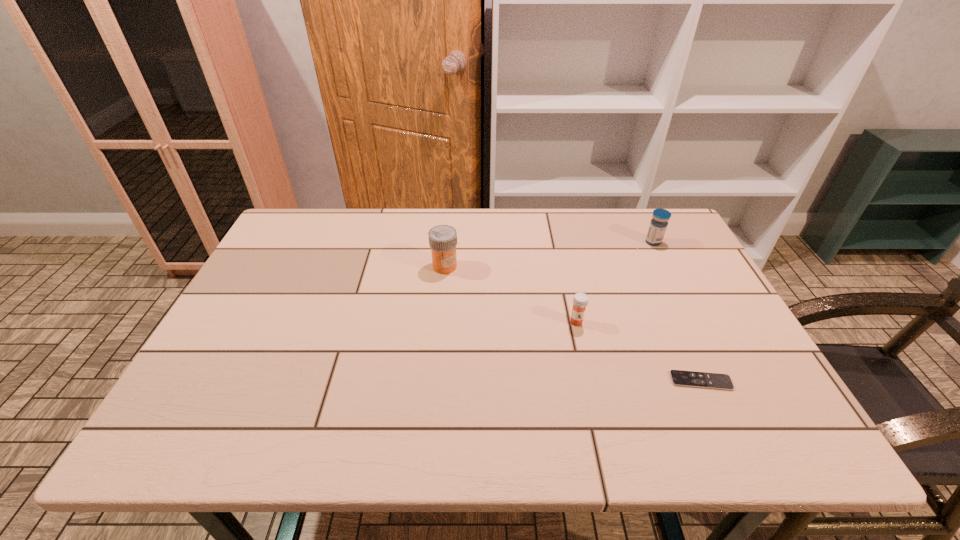
The height and width of the screenshot is (540, 960). In order to click on vacant region located on the label side of the third object from right to left in this screenshot , I will do `click(583, 353)`.

Identify the location of vacant region located 0.400m on the left of the nearest object. (492, 381).

Find the location of a particular element. Image resolution: width=960 pixels, height=540 pixels. object located in the far edge section of the desktop is located at coordinates (658, 225).

The height and width of the screenshot is (540, 960). Find the location of `medicine that is positioned at the right edge`. medicine that is positioned at the right edge is located at coordinates (658, 225).

At what (x,y) coordinates should I click in order to perform the action: click on remote control that is at the right edge. Please return your answer as a coordinate pair (x, y). Image resolution: width=960 pixels, height=540 pixels. Looking at the image, I should click on (679, 378).

Where is `object present at the far right corner`? The width and height of the screenshot is (960, 540). object present at the far right corner is located at coordinates (658, 225).

What are the coordinates of `blank space at the far edge of the desktop` in the screenshot? It's located at (468, 208).

This screenshot has height=540, width=960. In the image, there is a desktop. In order to click on free space at the near edge in this screenshot , I will do `click(321, 420)`.

You are a GUI agent. You are given a task and a screenshot of the screen. Output one action in this format:
    pyautogui.click(x=<x>, y=<y>)
    Task: Click on the vacant space at the left edge of the desktop
    
    Given the screenshot: What is the action you would take?
    pyautogui.click(x=262, y=370)

I want to click on vacant space at the right edge of the desktop, so click(x=683, y=350).